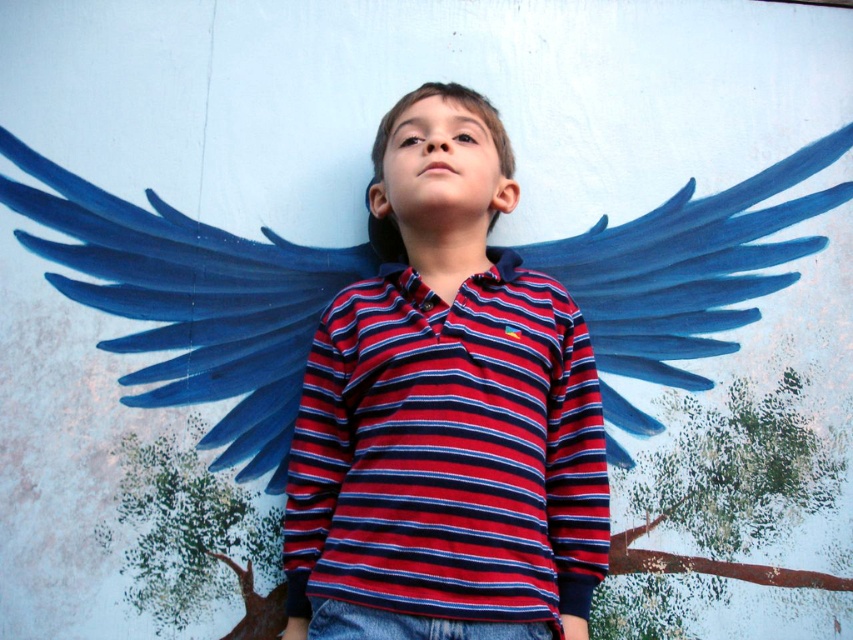
Question: Is red striped shirt at center to the right of blue matte wings at upper center from the viewer's perspective?

Choices:
 (A) yes
 (B) no

Answer: (A)

Question: Can you confirm if red striped shirt at center is thinner than blue matte wings at upper center?

Choices:
 (A) yes
 (B) no

Answer: (A)

Question: Is red striped shirt at center wider than blue matte wings at upper center?

Choices:
 (A) yes
 (B) no

Answer: (B)

Question: Which object is farther from the camera taking this photo?

Choices:
 (A) red striped shirt at center
 (B) blue matte wings at upper center

Answer: (B)